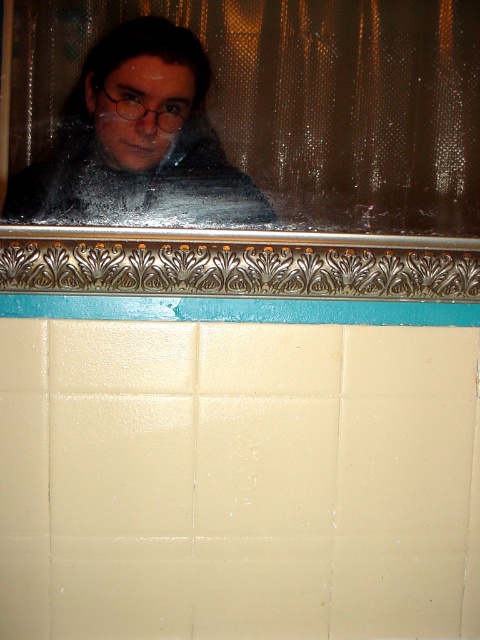
You are designing a layout for a poster and need to place two elements. The metallic frame at upper center and the matte black scarf at upper center must be arranged vertically. Based on the scene, which element should be placed higher up to maintain the visual hierarchy?

The metallic frame at upper center should be placed higher up since it is taller than the matte black scarf at upper center, maintaining the visual hierarchy by emphasizing its prominence.

You are trying to identify the position of the metallic frame at upper center and the matte black scarf at upper center in the image. Based on the scene description, which object is located higher up?

The matte black scarf at upper center is located higher up because the metallic frame at upper center is positioned below it.

You are a window cleaner assessing the scene. You see the metallic frame at upper center and the matte black scarf at upper center. Which object is bigger in size?

The metallic frame at upper center is larger in size compared to the matte black scarf at upper center.